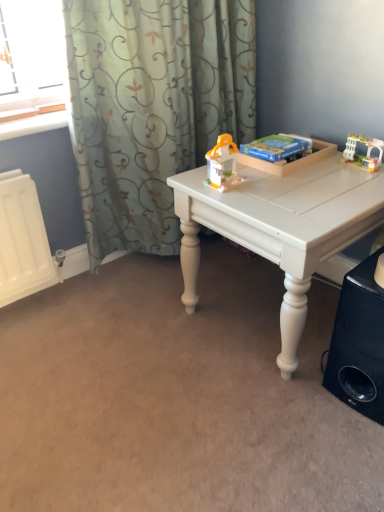
This screenshot has height=512, width=384. Identify the location of free space to the left of translucent plastic toy at center, which ranks as the first toy in left-to-right order. (191, 182).